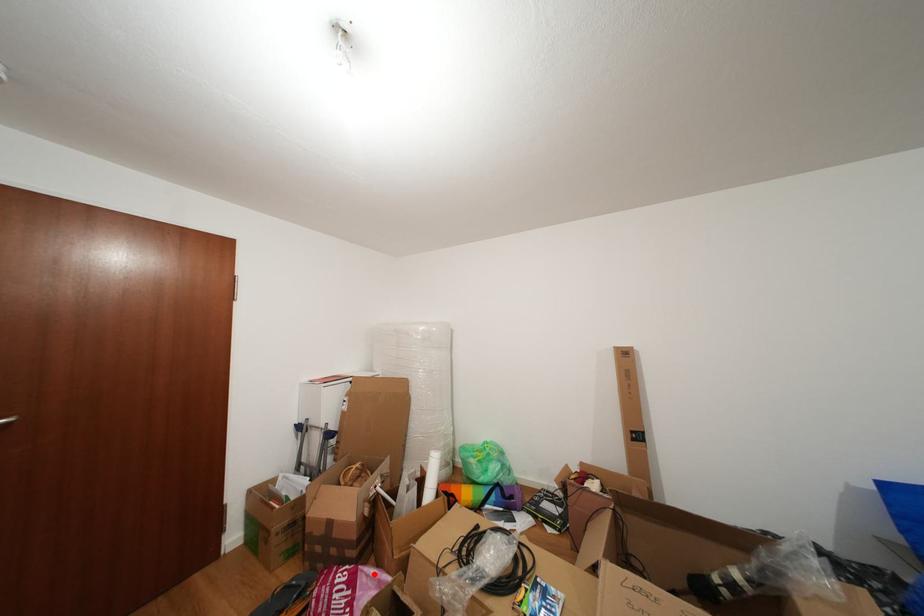
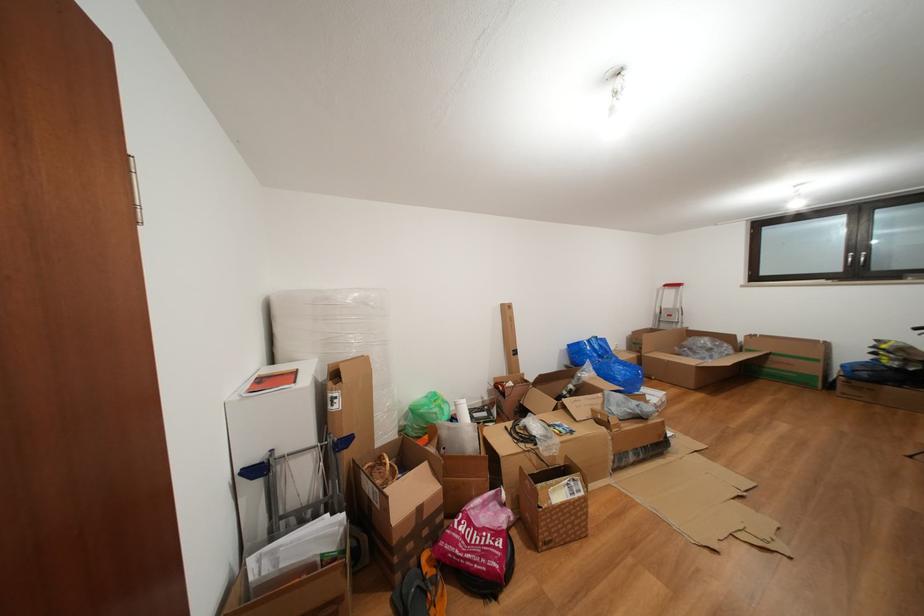
In the second image, find the point that corresponds to the highlighted location in the first image.

(480, 511)